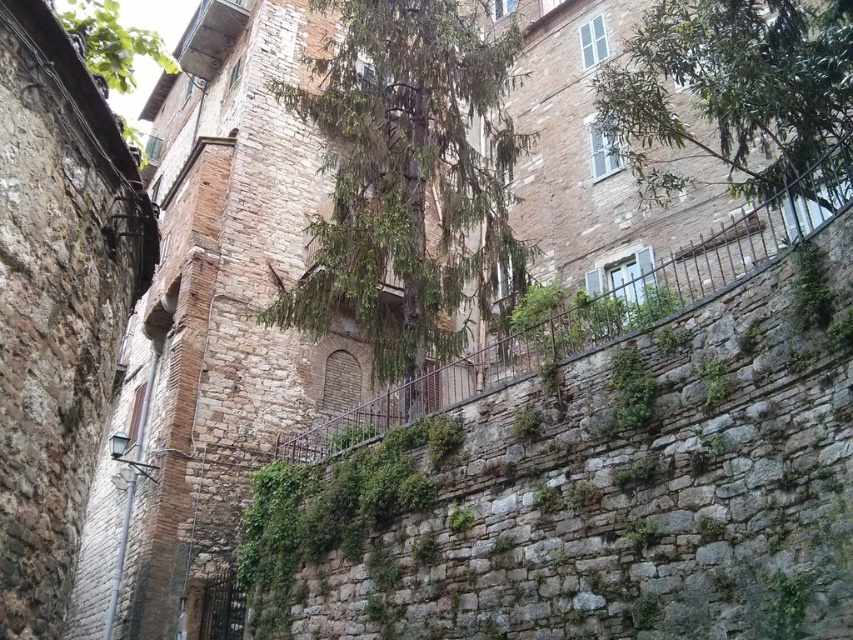
You are standing in the historic city square and see two green leafy trees. One is labeled as the green leafy tree at center and the other as the green leafy tree at upper center. Which tree is located to the left when viewed from your perspective?

The green leafy tree at center is positioned on the left side of the green leafy tree at upper center, so the green leafy tree at center is to the left.

You are standing in front of the historic building and notice two green leafy trees. One is labeled as the green leafy tree at center and the other as the green leafy tree at upper center. Which tree is positioned higher in the image?

The green leafy tree at upper center is positioned higher in the image than the green leafy tree at center.

You are standing at the lower part of the historic building and want to reach the upper part. There are two points marked on the wall. Which point, point (314,275) or point (624,141), is closer to you?

Point (314,275) is closer to you because it is in front of point (624,141).